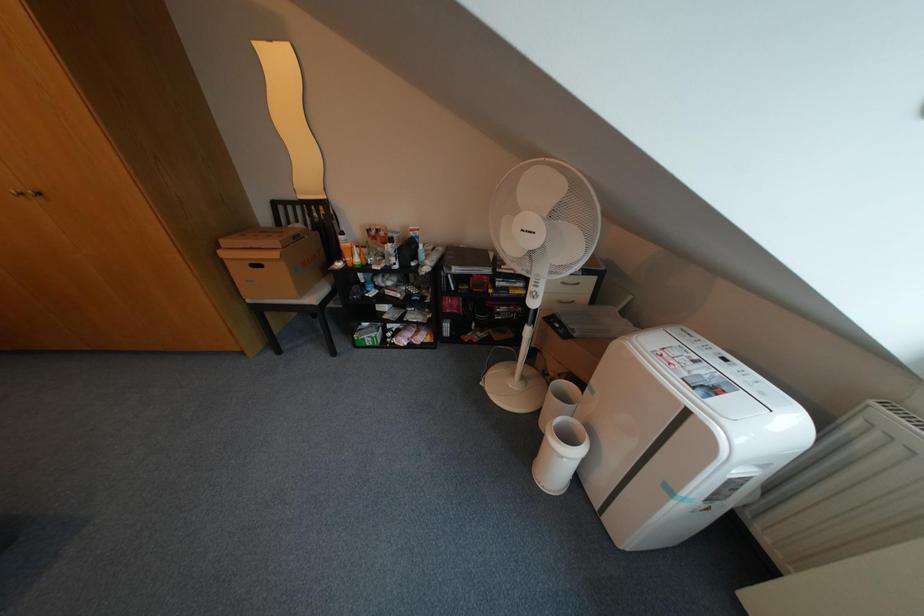
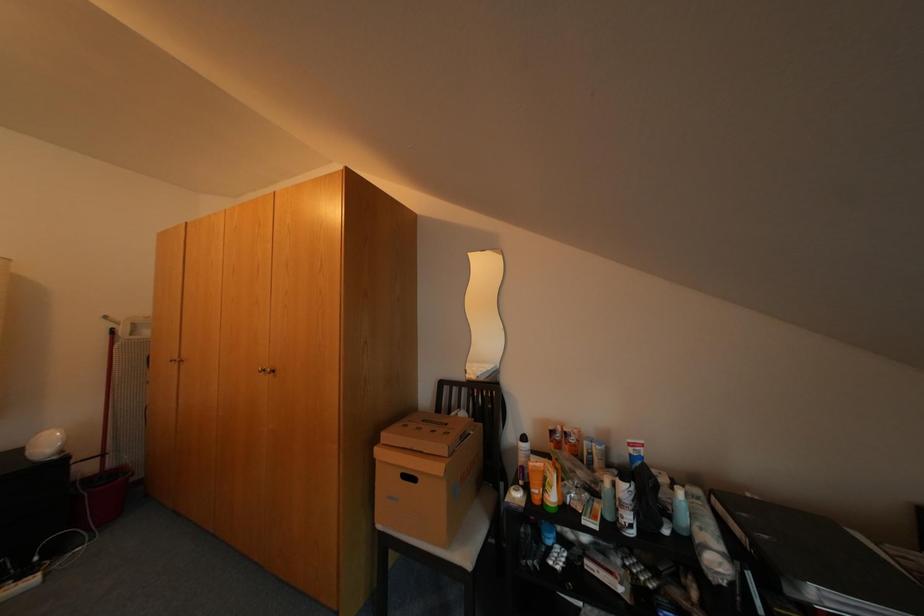
The images are taken continuously from a first-person perspective. In which direction is your viewpoint rotating?

The camera rotated toward left-up.